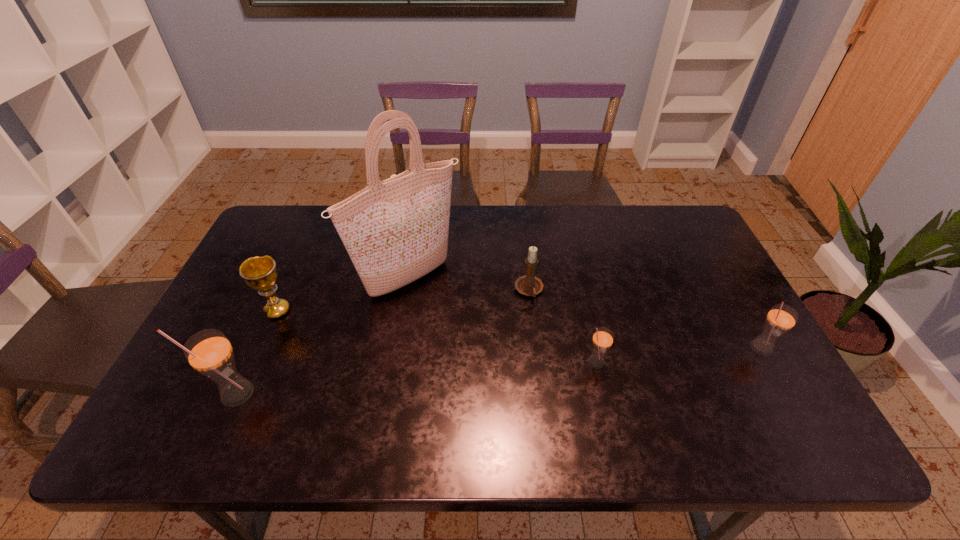
Image resolution: width=960 pixels, height=540 pixels. What are the coordinates of `free point between the rightmost straw and the candle holder` in the screenshot? It's located at (644, 319).

Locate an element on the screen. free area in between the second object from right to left and the chalice is located at coordinates (436, 336).

Where is `vacant space in between the chalice and the rightmost straw`? vacant space in between the chalice and the rightmost straw is located at coordinates (518, 329).

I want to click on free area in between the tallest straw and the rightmost object, so click(x=498, y=370).

Where is `free space between the chalice and the second straw from left to right`? The height and width of the screenshot is (540, 960). free space between the chalice and the second straw from left to right is located at coordinates (436, 336).

This screenshot has width=960, height=540. What are the coordinates of `free space between the second tallest straw and the tallest straw` in the screenshot? It's located at (498, 370).

Locate an element on the screen. The height and width of the screenshot is (540, 960). object that is the second closest to the fourth object from left to right is located at coordinates (602, 340).

Locate an element on the screen. object that is the second nearest to the chalice is located at coordinates (209, 352).

Select which straw appears as the closest to the fifth object from left to right. Please provide its 2D coordinates. Your answer should be formatted as a tuple, i.e. [(x, y)], where the tuple contains the x and y coordinates of a point satisfying the conditions above.

[(781, 318)]

The image size is (960, 540). What are the coordinates of `straw that is the closest one to the chalice` in the screenshot? It's located at (209, 352).